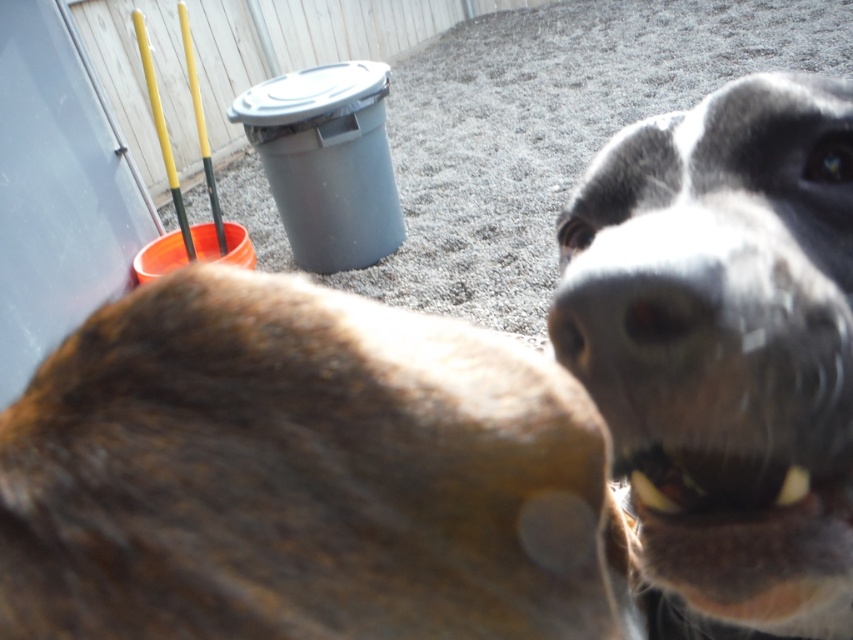
Who is higher up, brown fur at center or black smooth nose at center?

black smooth nose at center is above.

Where is `brown fur at center`? The height and width of the screenshot is (640, 853). brown fur at center is located at coordinates (302, 476).

Locate an element on the screen. This screenshot has height=640, width=853. brown fur at center is located at coordinates (302, 476).

Can you confirm if brown fur at center is shorter than white glossy teeth at lower right?

Incorrect, brown fur at center's height does not fall short of white glossy teeth at lower right's.

Does brown fur at center have a lesser width compared to white glossy teeth at lower right?

In fact, brown fur at center might be wider than white glossy teeth at lower right.

Between point (230, 564) and point (685, 449), which one is positioned behind?

The point (685, 449) is more distant.

The image size is (853, 640). Find the location of `brown fur at center`. brown fur at center is located at coordinates (302, 476).

Between point (722, 220) and point (689, 500), which one is positioned in front?

Positioned in front is point (722, 220).

Is point (833, 582) closer to viewer compared to point (688, 452)?

No, it is not.

The width and height of the screenshot is (853, 640). What do you see at coordinates (724, 353) in the screenshot?
I see `black fur dog at center` at bounding box center [724, 353].

Where is `black fur dog at center`? Image resolution: width=853 pixels, height=640 pixels. black fur dog at center is located at coordinates (724, 353).